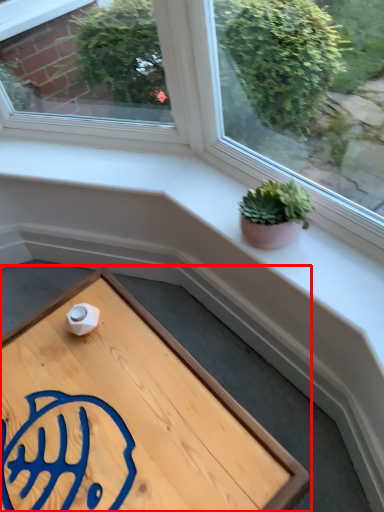
Question: From the image's perspective, what is the correct spatial relationship of table (annotated by the red box) in relation to houseplant?

Choices:
 (A) below
 (B) above

Answer: (A)